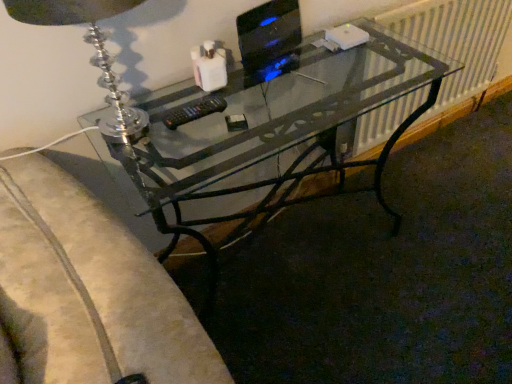
Question: Considering the relative sizes of transparent glass desk at center and black glossy monitor at upper right in the image provided, is transparent glass desk at center smaller than black glossy monitor at upper right?

Choices:
 (A) yes
 (B) no

Answer: (B)

Question: Is there a large distance between transparent glass desk at center and black glossy monitor at upper right?

Choices:
 (A) no
 (B) yes

Answer: (A)

Question: Are transparent glass desk at center and black glossy monitor at upper right beside each other?

Choices:
 (A) no
 (B) yes

Answer: (A)

Question: Can you confirm if transparent glass desk at center is positioned to the left of black glossy monitor at upper right?

Choices:
 (A) yes
 (B) no

Answer: (B)

Question: Is transparent glass desk at center oriented away from black glossy monitor at upper right?

Choices:
 (A) yes
 (B) no

Answer: (B)

Question: Is transparent glass desk at center in front of black glossy monitor at upper right?

Choices:
 (A) no
 (B) yes

Answer: (B)

Question: Is the depth of black glossy monitor at upper right less than that of black plastic remote at center?

Choices:
 (A) no
 (B) yes

Answer: (A)

Question: Does black glossy monitor at upper right come behind black plastic remote at center?

Choices:
 (A) no
 (B) yes

Answer: (B)

Question: Can you see black glossy monitor at upper right touching black plastic remote at center?

Choices:
 (A) no
 (B) yes

Answer: (A)

Question: Is black glossy monitor at upper right smaller than black plastic remote at center?

Choices:
 (A) yes
 (B) no

Answer: (B)

Question: Can we say black glossy monitor at upper right lies outside black plastic remote at center?

Choices:
 (A) no
 (B) yes

Answer: (B)

Question: Is black glossy monitor at upper right taller than black plastic remote at center?

Choices:
 (A) no
 (B) yes

Answer: (B)

Question: Is black glossy monitor at upper right facing away from clear glass table lamp at upper left?

Choices:
 (A) yes
 (B) no

Answer: (B)